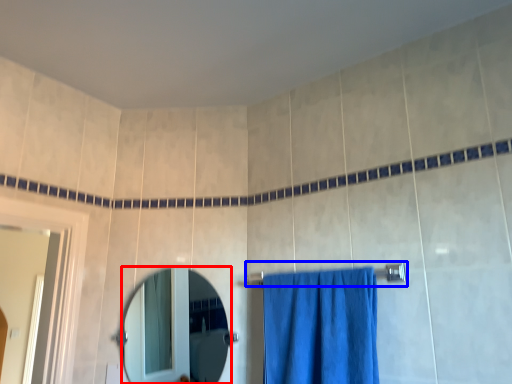
Question: Which object appears closest to the camera in this image, mirror (highlighted by a red box) or towel bar (highlighted by a blue box)?

Choices:
 (A) mirror
 (B) towel bar

Answer: (B)